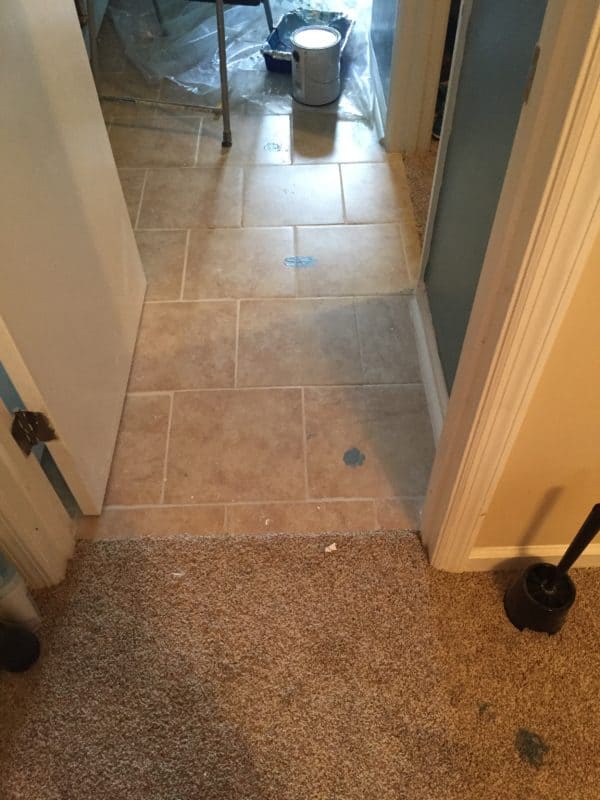
In order to click on metal door hinge on left side of door in this screenshot , I will do `click(32, 442)`.